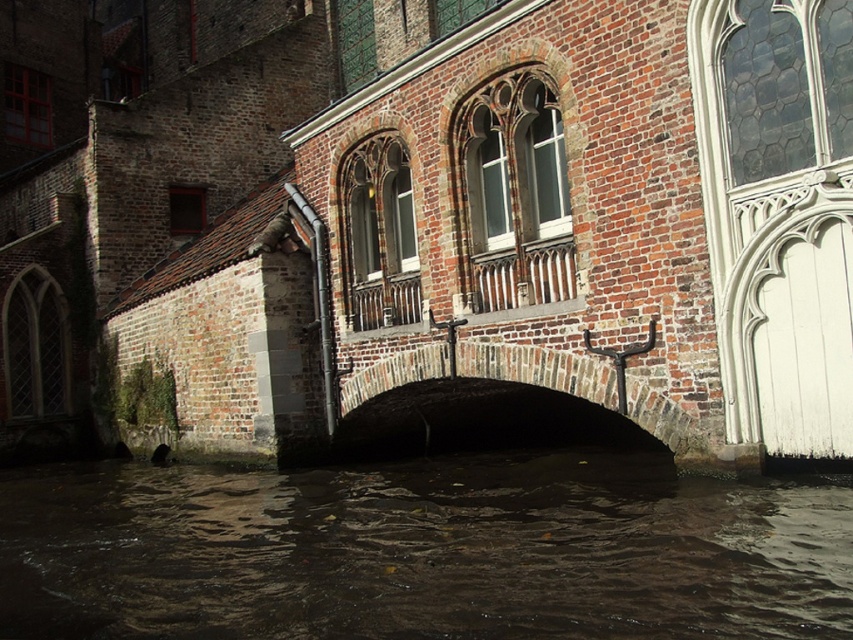
You are a tour guide leading a group of visitors to the historic brick building by the canal. You want to point out both the brown murky water at center and the brick stone bridge at center. Which one is bigger in size?

The brown murky water at center has a larger size compared to the brick stone bridge at center.

You are a tourist standing on the brick stone bridge at center and looking down. Can you see the brown murky water at center from your current position?

Yes, because the brown murky water at center is located below the brick stone bridge at center, so you can see it directly beneath you.

You are a tourist standing on the bank of the canal and want to cross to the other side. You see the brown murky water at center and the brick stone bridge at center. Which object should you step onto to safely cross the canal?

You should step onto the brick stone bridge at center to safely cross the canal because the brown murky water at center is in front of it and likely part of the canal itself, making the bridge the safe path.